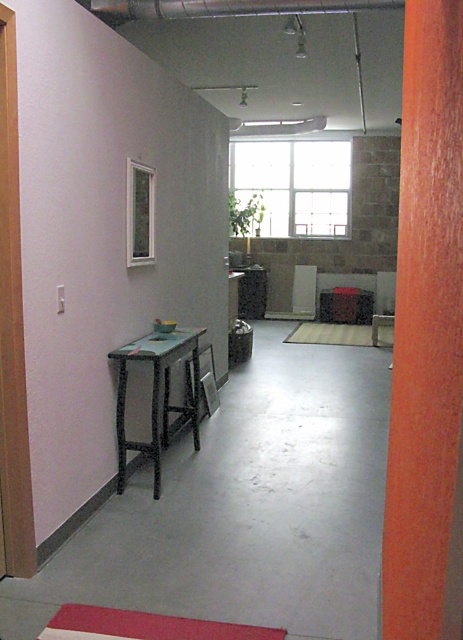
Is matte black table at left wider than matte wood chair at center?

Indeed, matte black table at left has a greater width compared to matte wood chair at center.

Who is positioned more to the left, matte black table at left or matte wood chair at center?

matte black table at left is more to the left.

Does point (161, 340) lie behind point (381, 276)?

That is False.

In order to click on matte black table at left in this screenshot , I will do `click(156, 394)`.

Is the position of red rubber mat at center less distant than that of matte wood chair at center?

Yes, it is.

Is the position of red rubber mat at center more distant than that of matte wood chair at center?

That is False.

I want to click on red rubber mat at center, so click(343, 333).

Where is `red rubber mat at center`? red rubber mat at center is located at coordinates (343, 333).

Who is positioned more to the right, matte black table at left or red rubber mat at lower center?

red rubber mat at lower center is more to the right.

Is point (170, 337) less distant than point (114, 625)?

No, it is behind (114, 625).

What do you see at coordinates (156, 394) in the screenshot? The width and height of the screenshot is (463, 640). I see `matte black table at left` at bounding box center [156, 394].

Identify the location of matte black table at left. (156, 394).